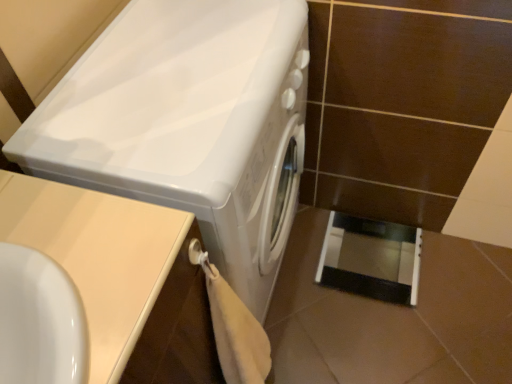
Where is `black glossy screen door at lower right`? The width and height of the screenshot is (512, 384). black glossy screen door at lower right is located at coordinates (371, 259).

This screenshot has width=512, height=384. Find the location of `black glossy screen door at lower right`. black glossy screen door at lower right is located at coordinates (371, 259).

Which is less distant, (327, 265) or (246, 5)?

Point (327, 265).

Does black glossy screen door at lower right have a greater height compared to white glossy washing machine at center?

No.

Does black glossy screen door at lower right come behind white glossy washing machine at center?

That is True.

From a real-world perspective, does black glossy screen door at lower right sit lower than white glossy washing machine at center?

Yes, from a real-world perspective, black glossy screen door at lower right is beneath white glossy washing machine at center.

How distant is white glossy washing machine at center from black glossy screen door at lower right?

27.99 inches.

Based on their positions, is white glossy washing machine at center located to the left or right of black glossy screen door at lower right?

white glossy washing machine at center is to the left of black glossy screen door at lower right.

Is white glossy washing machine at center not close to black glossy screen door at lower right?

No.

Is beige laminate counter top at lower left located within white glossy washing machine at center?

That's incorrect, beige laminate counter top at lower left is not inside white glossy washing machine at center.

Which point is more forward, (305, 5) or (31, 247)?

The point (31, 247) is more forward.

Is white glossy washing machine at center wider or thinner than beige laminate counter top at lower left?

white glossy washing machine at center is thinner than beige laminate counter top at lower left.

From the picture: From the image's perspective, which one is positioned lower, white glossy washing machine at center or beige laminate counter top at lower left?

beige laminate counter top at lower left appears lower in the image.

Is the depth of black glossy screen door at lower right greater than that of beige laminate counter top at lower left?

Yes, the depth of black glossy screen door at lower right is greater than that of beige laminate counter top at lower left.

Does black glossy screen door at lower right contain beige laminate counter top at lower left?

No, beige laminate counter top at lower left is not surrounded by black glossy screen door at lower right.

In terms of height, does black glossy screen door at lower right look taller or shorter compared to beige laminate counter top at lower left?

black glossy screen door at lower right is shorter than beige laminate counter top at lower left.

In the scene shown: Between black glossy screen door at lower right and beige laminate counter top at lower left, which one appears on the left side from the viewer's perspective?

beige laminate counter top at lower left is more to the left.

I want to click on washing machine to the right of beige laminate counter top at lower left, so click(189, 124).

How distant is beige laminate counter top at lower left from white glossy washing machine at center?

The distance of beige laminate counter top at lower left from white glossy washing machine at center is 9.32 inches.

In terms of size, does beige laminate counter top at lower left appear bigger or smaller than white glossy washing machine at center?

Considering their sizes, beige laminate counter top at lower left takes up less space than white glossy washing machine at center.

Who is shorter, beige laminate counter top at lower left or white glossy washing machine at center?

Standing shorter between the two is beige laminate counter top at lower left.

Does beige laminate counter top at lower left have a lesser width compared to black glossy screen door at lower right?

Incorrect, the width of beige laminate counter top at lower left is not less than that of black glossy screen door at lower right.

Between beige laminate counter top at lower left and black glossy screen door at lower right, which one has less height?

Standing shorter between the two is black glossy screen door at lower right.

Which is behind, beige laminate counter top at lower left or black glossy screen door at lower right?

black glossy screen door at lower right is behind.

In the image, there is a black glossy screen door at lower right. At what (x,y) coordinates should I click in order to perform the action: click on washing machine above it (from the image's perspective). Please return your answer as a coordinate pair (x, y). Image resolution: width=512 pixels, height=384 pixels. Looking at the image, I should click on (189, 124).

This screenshot has width=512, height=384. Identify the location of washing machine on the left of black glossy screen door at lower right. (189, 124).

Which object lies nearer to the anchor point white glossy washing machine at center, black glossy screen door at lower right or beige laminate counter top at lower left?

Among the two, beige laminate counter top at lower left is located nearer to white glossy washing machine at center.

Which object lies further to the anchor point black glossy screen door at lower right, beige laminate counter top at lower left or white glossy washing machine at center?

The object further to black glossy screen door at lower right is beige laminate counter top at lower left.

When comparing their distances from beige laminate counter top at lower left, does black glossy screen door at lower right or white glossy washing machine at center seem further?

The object further to beige laminate counter top at lower left is black glossy screen door at lower right.

Looking at the image, which one is located closer to black glossy screen door at lower right, white glossy washing machine at center or beige laminate counter top at lower left?

Based on the image, white glossy washing machine at center appears to be nearer to black glossy screen door at lower right.

Looking at the image, which one is located closer to white glossy washing machine at center, beige laminate counter top at lower left or black glossy screen door at lower right?

beige laminate counter top at lower left lies closer to white glossy washing machine at center than the other object.

Looking at the image, which one is located closer to beige laminate counter top at lower left, white glossy washing machine at center or black glossy screen door at lower right?

white glossy washing machine at center.

Where is `washing machine between beige laminate counter top at lower left and black glossy screen door at lower right from front to back`? washing machine between beige laminate counter top at lower left and black glossy screen door at lower right from front to back is located at coordinates (189, 124).